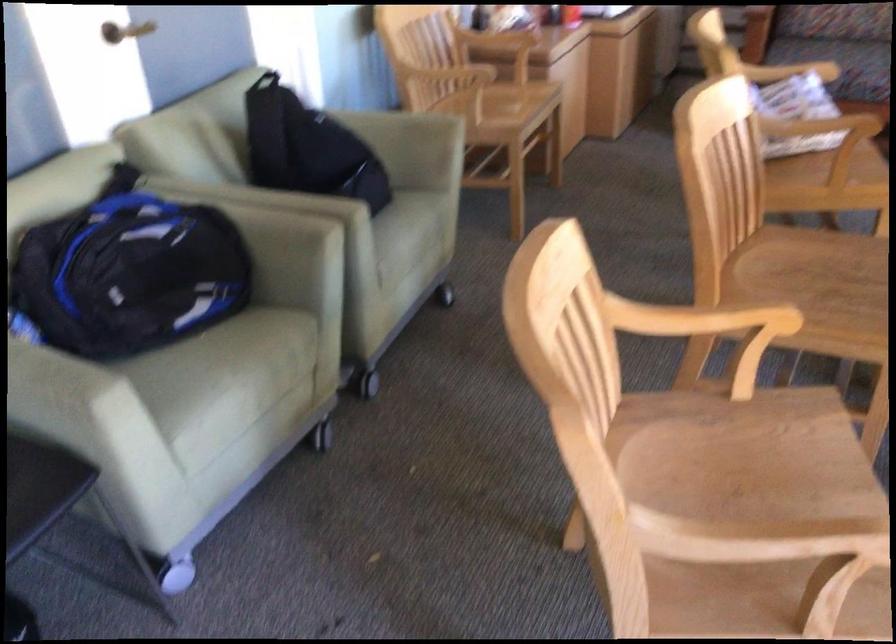
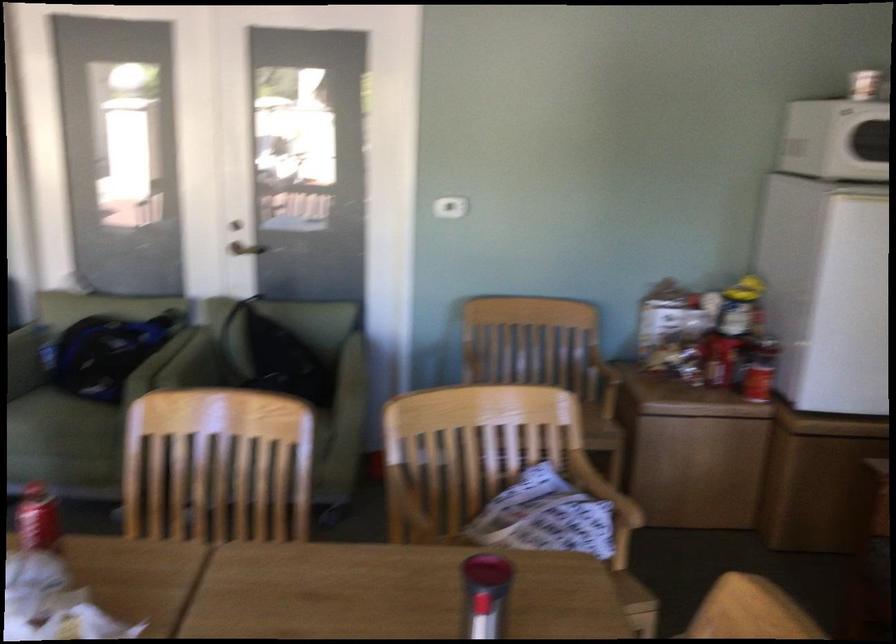
The point at (424,194) is marked in the first image. Where is the corresponding point in the second image?

(322, 436)